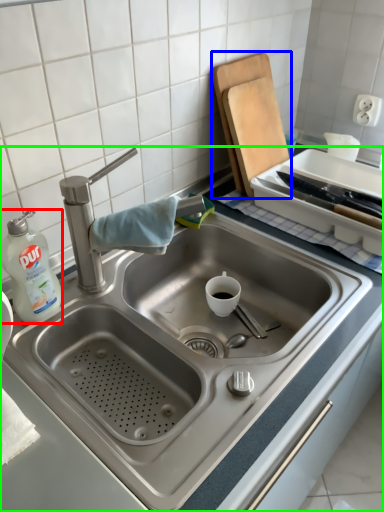
Question: Which object is positioned closest to cleaning product (highlighted by a red box)? Select from cutting board (highlighted by a blue box) and sink (highlighted by a green box).

Choices:
 (A) cutting board
 (B) sink

Answer: (B)